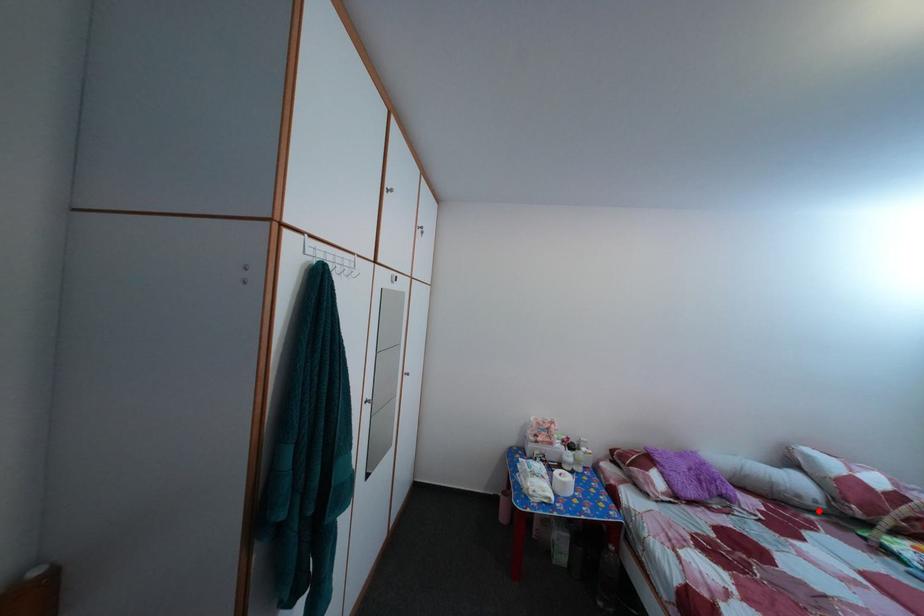
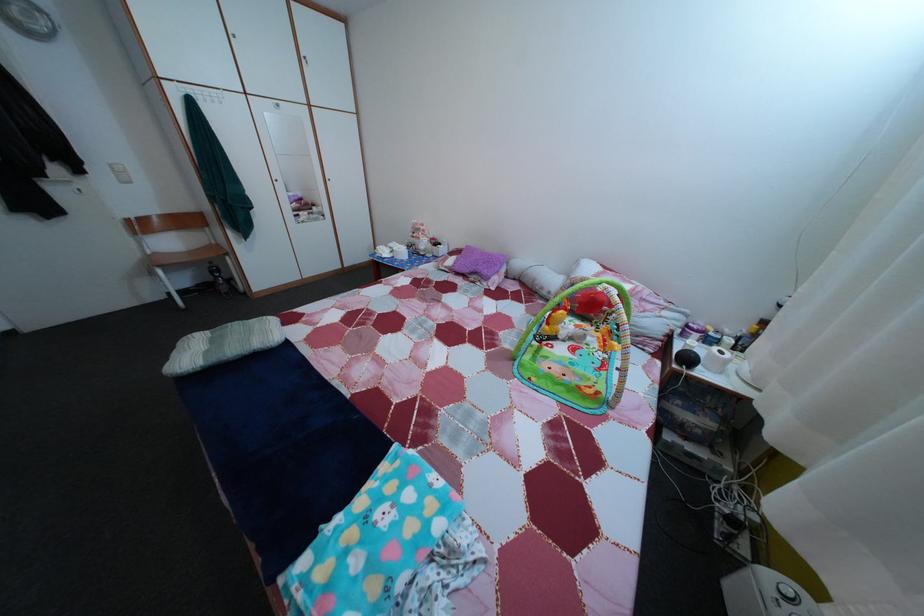
Locate, in the second image, the point that corresponds to the highlighted location in the first image.

(553, 301)